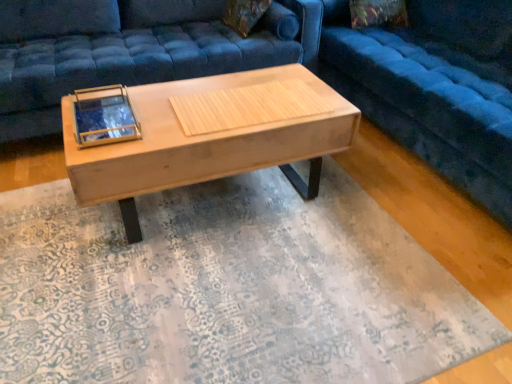
Find the location of a particular element. The height and width of the screenshot is (384, 512). free region under natural wood coffee table at center (from a real-world perspective) is located at coordinates (224, 198).